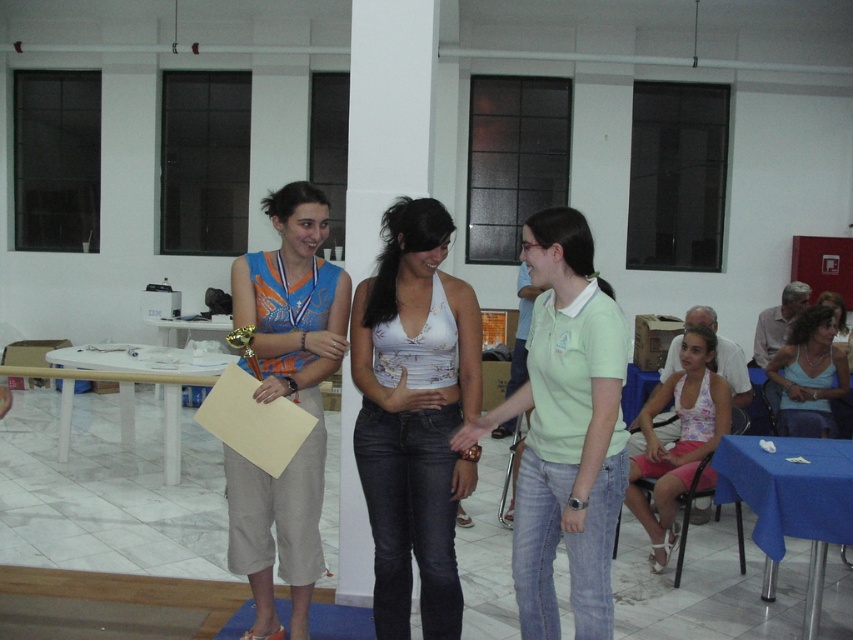
Does white cotton tank top at center appear on the right side of light green cotton shirt at center?

Incorrect, white cotton tank top at center is not on the right side of light green cotton shirt at center.

The image size is (853, 640). Describe the element at coordinates (415, 416) in the screenshot. I see `white cotton tank top at center` at that location.

Locate an element on the screen. Image resolution: width=853 pixels, height=640 pixels. white cotton tank top at center is located at coordinates (415, 416).

In order to click on white cotton tank top at center in this screenshot , I will do `click(415, 416)`.

Does floral fabric dress at lower right come behind light blue tank top at center?

No, floral fabric dress at lower right is closer to the viewer.

Does point (679, 385) come closer to viewer compared to point (782, 429)?

Yes.

The width and height of the screenshot is (853, 640). Identify the location of floral fabric dress at lower right. (677, 438).

Does point (567, 428) come farther from viewer compared to point (805, 362)?

No, (567, 428) is in front of (805, 362).

Is light green cotton shirt at center smaller than light blue tank top at center?

No, light green cotton shirt at center is not smaller than light blue tank top at center.

Does point (611, 397) lie in front of point (819, 422)?

Yes, point (611, 397) is in front of point (819, 422).

This screenshot has height=640, width=853. In order to click on light green cotton shirt at center in this screenshot , I will do `click(566, 429)`.